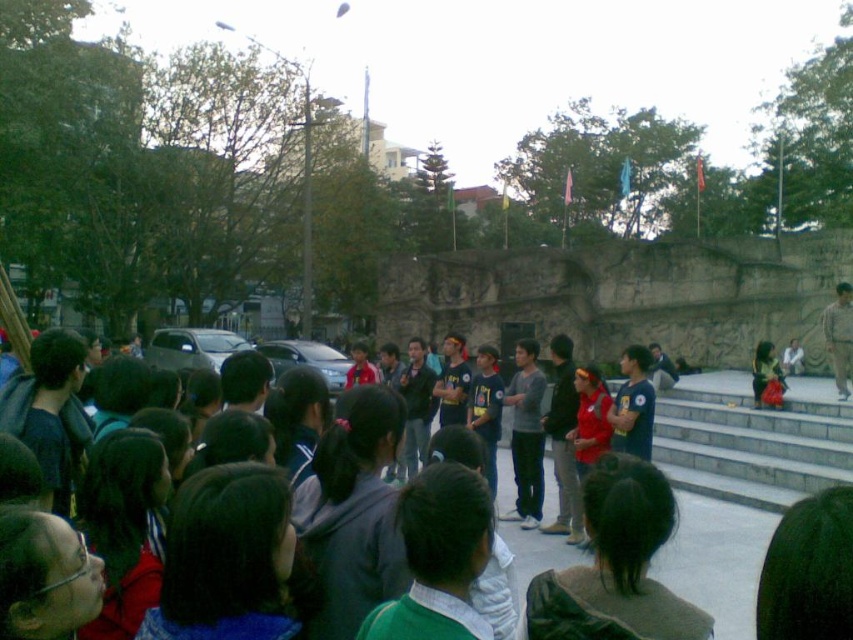
You are a photographer standing in the plaza and want to capture both the dark blue shirt at center and the blue denim jacket at center in a single photo. Which clothing item should you focus on first to ensure both are in the frame?

The dark blue shirt at center is positioned under the blue denim jacket at center, so you should focus on the blue denim jacket at center first to ensure both are captured in the frame.

You are a photographer standing in the public square. You want to capture a photo of the dark blue shirt at center and the red fabric dress at center. Which object should you zoom in on to ensure both are in focus without moving your camera position?

The dark blue shirt at center might be wider than red fabric dress at center, so you should zoom in on the wider object to ensure both are in focus.

Looking at this image, you are a photographer standing in the public square and want to take a photo of the dark blue shirt at center and the blue denim jacket at center. Which one should you focus on if you want to capture the wider object in your shot?

The dark blue shirt at center might be wider than blue denim jacket at center, so you should focus on the dark blue shirt at center to capture the wider object in your shot.